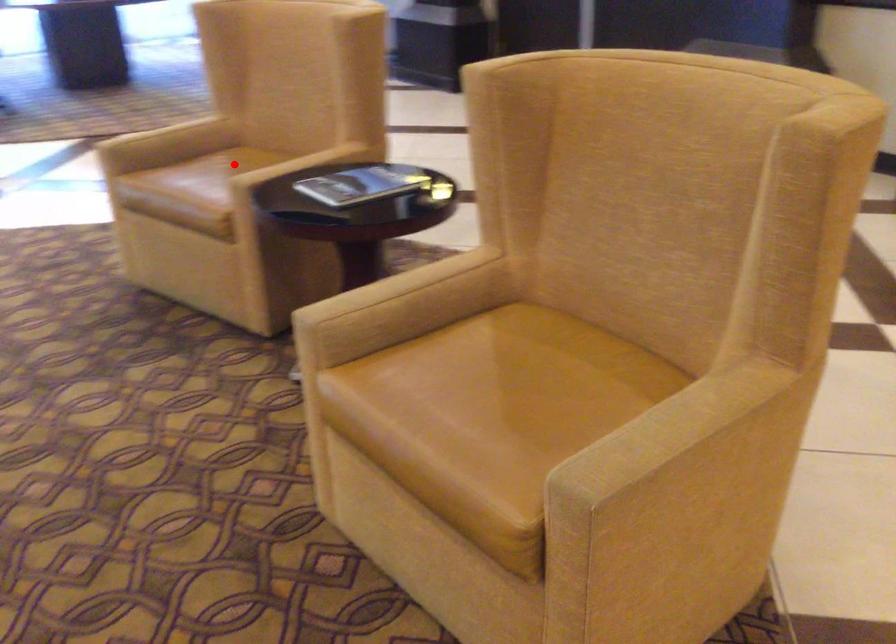
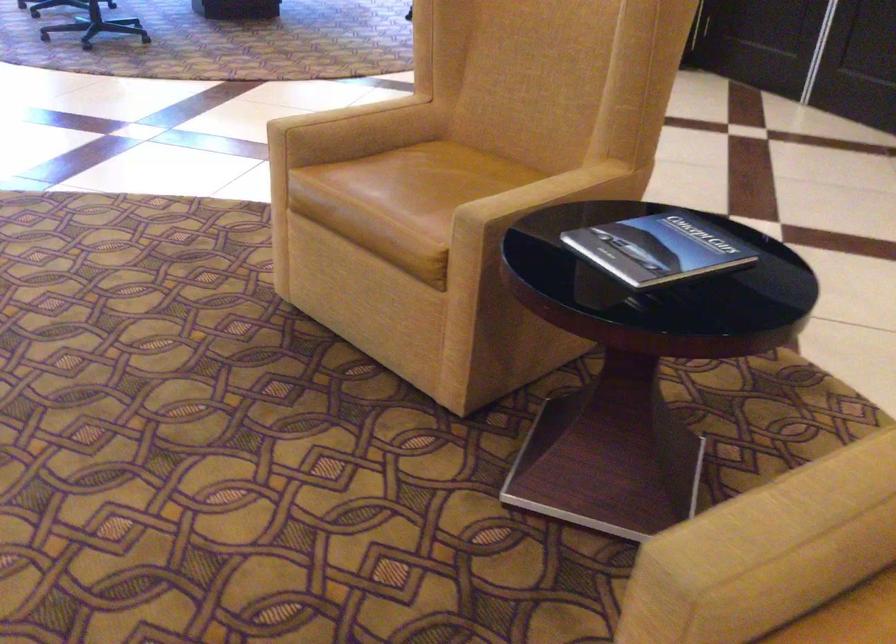
Question: I am providing you with two images of the same scene from different viewpoints. A red point is shown in image1. For the corresponding object point in image2, is it positioned nearer or farther from the camera?

Choices:
 (A) Nearer
 (B) Farther

Answer: (A)